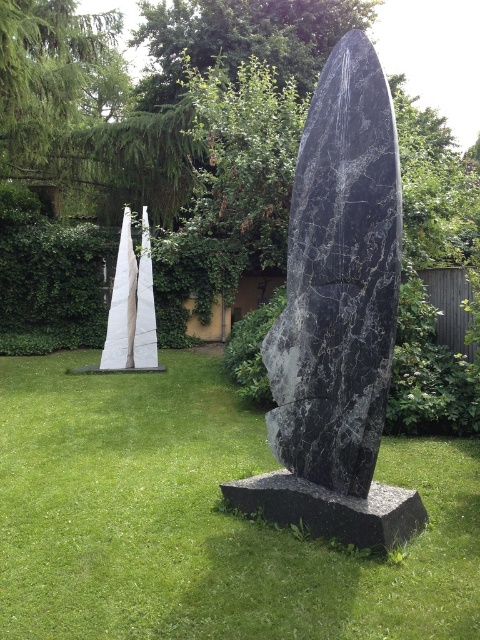
Question: Can you confirm if black marble sculpture at center is thinner than black marble stone at center?

Choices:
 (A) yes
 (B) no

Answer: (A)

Question: Which of the following is the farthest from the observer?

Choices:
 (A) black marble sculpture at center
 (B) green grass at center

Answer: (B)

Question: Which object is positioned closest to the black marble stone at center?

Choices:
 (A) black marble sculpture at center
 (B) green grass at center

Answer: (A)

Question: Which point appears closest to the camera in this image?

Choices:
 (A) (291, 512)
 (B) (34, 564)

Answer: (B)

Question: Can you confirm if green grass at center is positioned to the right of black marble sculpture at center?

Choices:
 (A) yes
 (B) no

Answer: (B)

Question: From the image, what is the correct spatial relationship of green grass at center in relation to black marble sculpture at center?

Choices:
 (A) right
 (B) left

Answer: (B)